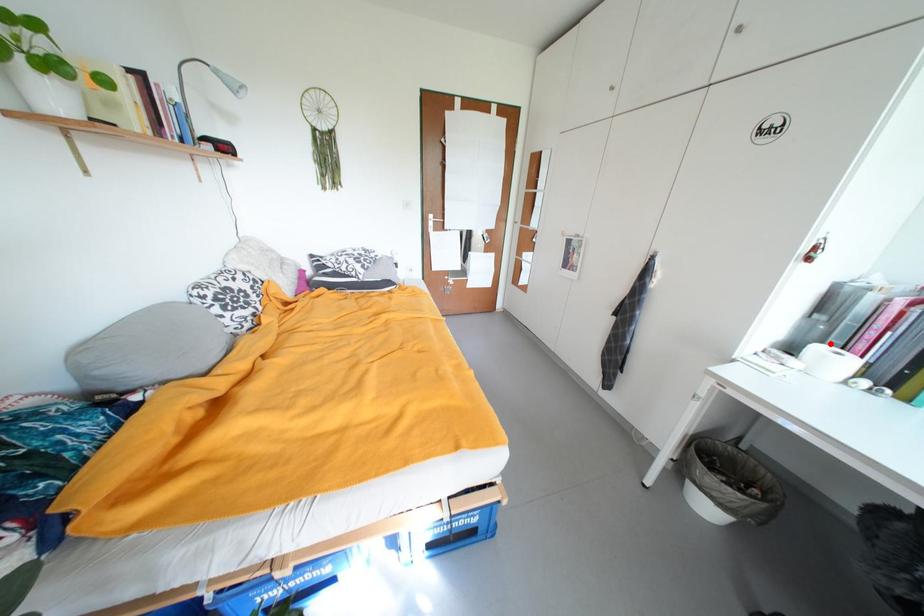
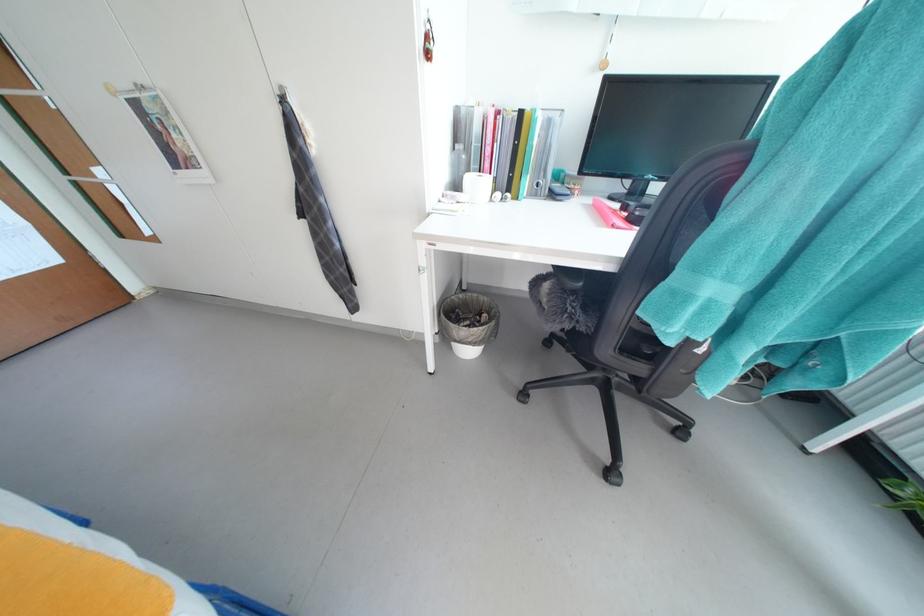
Locate, in the second image, the point that corresponds to the highlighted location in the first image.

(477, 172)